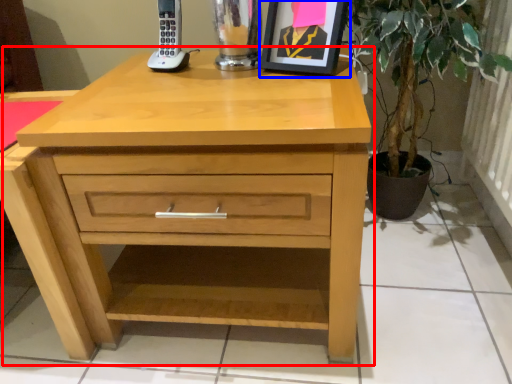
Question: Which object is further to the camera taking this photo, chest of drawers (highlighted by a red box) or picture frame (highlighted by a blue box)?

Choices:
 (A) chest of drawers
 (B) picture frame

Answer: (B)